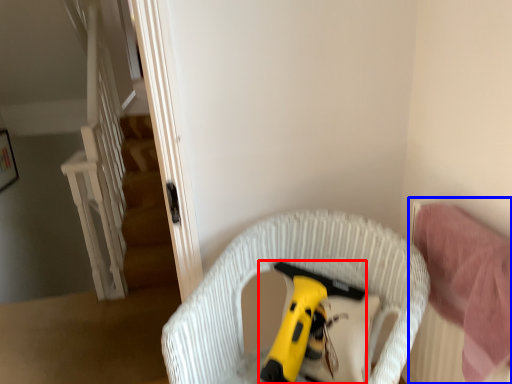
Question: Which object appears closest to the camera in this image, toy (highlighted by a red box) or bed (highlighted by a blue box)?

Choices:
 (A) toy
 (B) bed

Answer: (B)